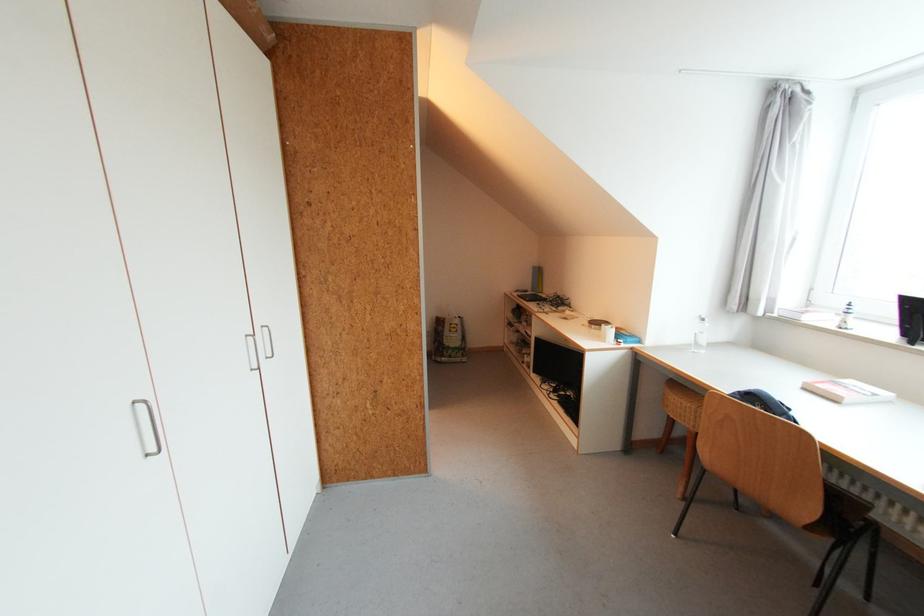
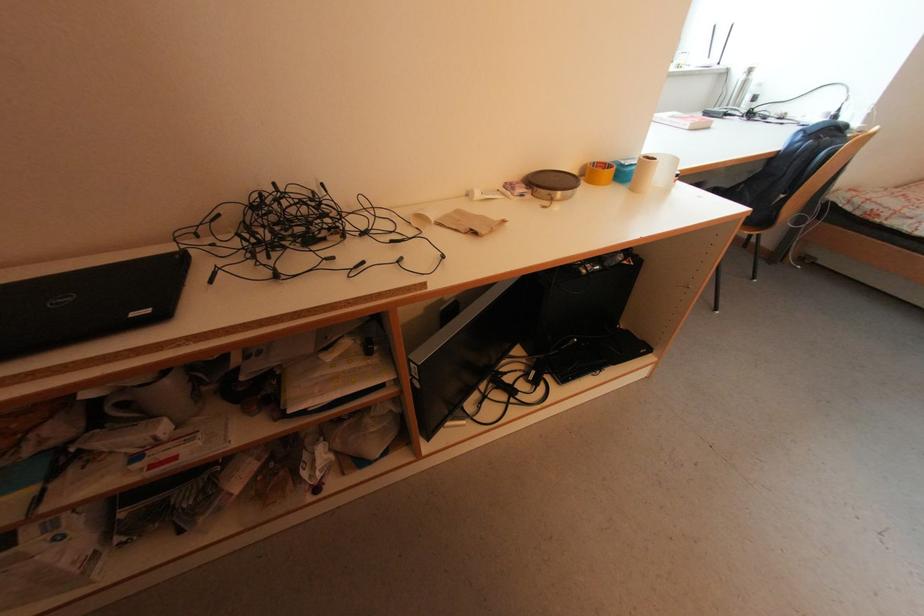
Locate, in the second image, the point that corresponds to point (532, 302) in the first image.

(168, 317)